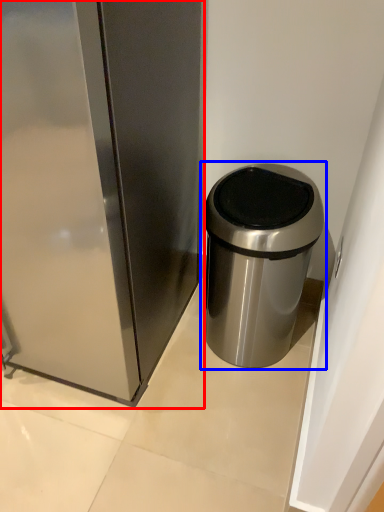
Question: Among these objects, which one is farthest to the camera, appliance (highlighted by a red box) or waste container (highlighted by a blue box)?

Choices:
 (A) appliance
 (B) waste container

Answer: (B)